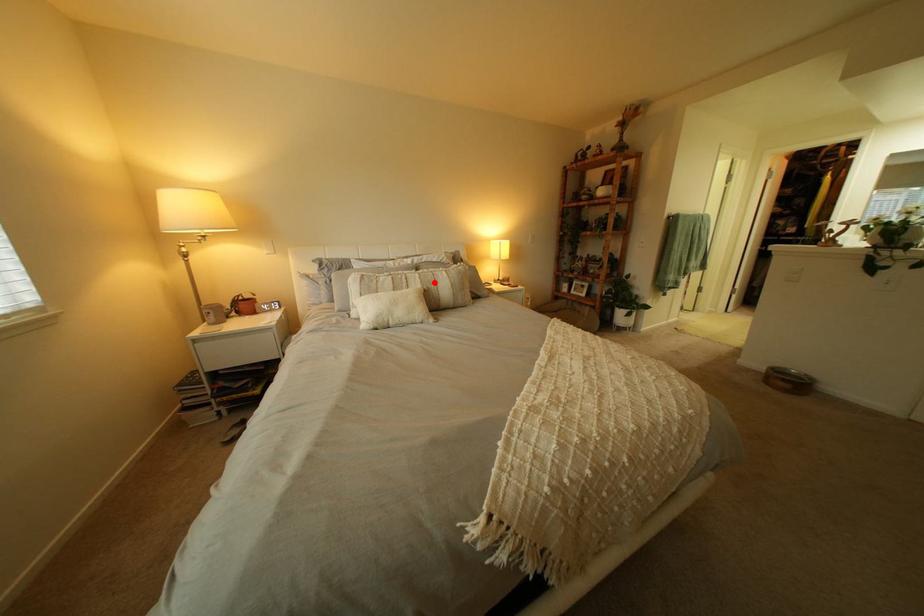
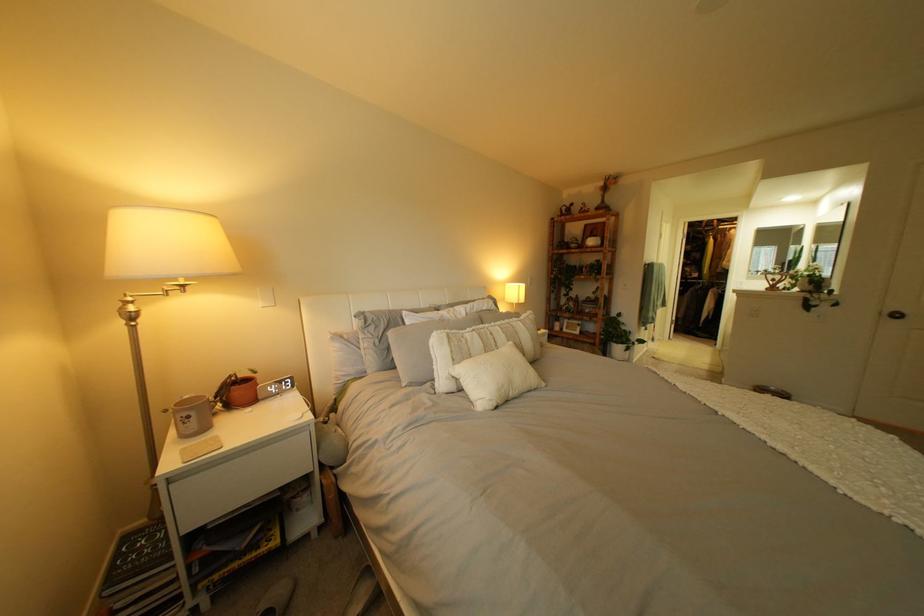
Question: A red point is marked in image1. In image2, is the corresponding 3D point closer to the camera or farther? Reply with the corresponding letter.

Choices:
 (A) The corresponding 3D point is closer.
 (B) The corresponding 3D point is farther.

Answer: (B)